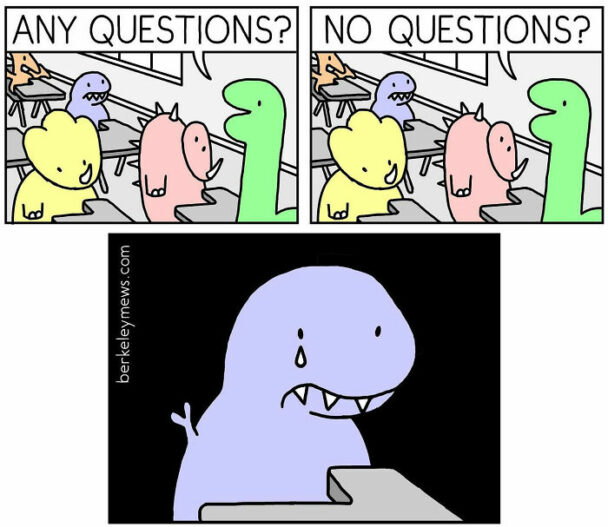
Identify the location of window. The width and height of the screenshot is (608, 527). (464, 69), (163, 63).